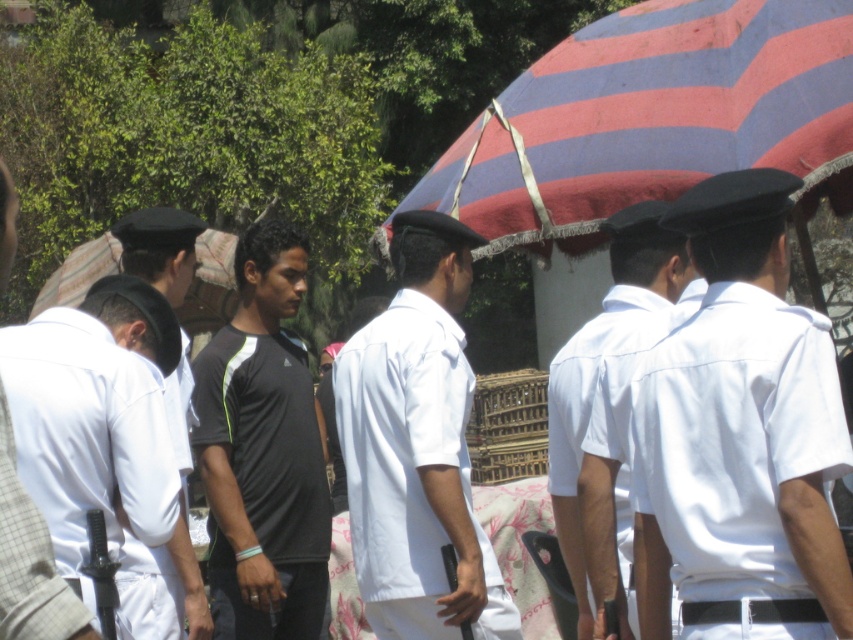
Does striped fabric umbrella at upper right have a lesser height compared to white smooth shirt at right?

In fact, striped fabric umbrella at upper right may be taller than white smooth shirt at right.

Between point (718, 152) and point (688, 586), which one is positioned in front?

Point (688, 586) is more forward.

At what (x,y) coordinates should I click in order to perform the action: click on striped fabric umbrella at upper right. Please return your answer as a coordinate pair (x, y). This screenshot has height=640, width=853. Looking at the image, I should click on (650, 120).

Does point (660, 394) come closer to viewer compared to point (572, 483)?

That is True.

In the scene shown: Is white smooth shirt at right shorter than white smooth uniform at center?

Indeed, white smooth shirt at right has a lesser height compared to white smooth uniform at center.

The width and height of the screenshot is (853, 640). What are the coordinates of `white smooth shirt at right` in the screenshot? It's located at (738, 461).

Is white smooth shirt at right above black matte t-shirt at center?

No, white smooth shirt at right is not above black matte t-shirt at center.

Is white smooth shirt at right further to the viewer compared to black matte t-shirt at center?

No.

Which is behind, point (759, 323) or point (231, 554)?

The point (231, 554) is more distant.

I want to click on white smooth shirt at right, so click(x=738, y=461).